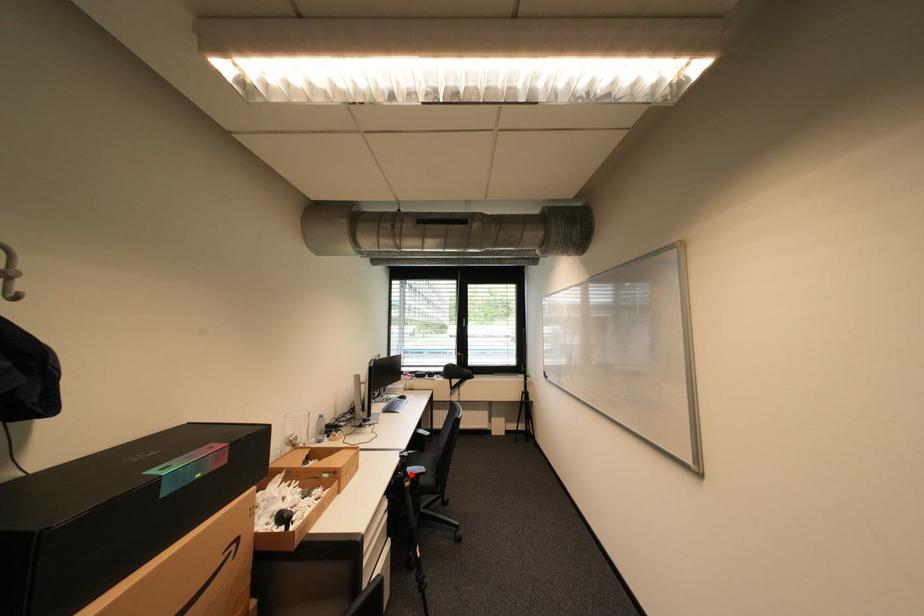
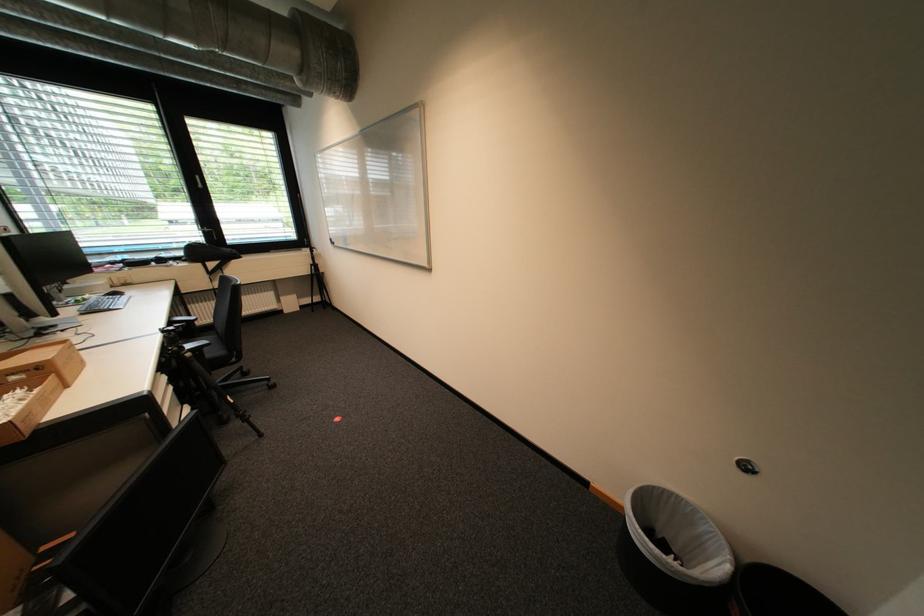
The point at the highlighted location is marked in the first image. Where is the corresponding point in the second image?

(185, 349)